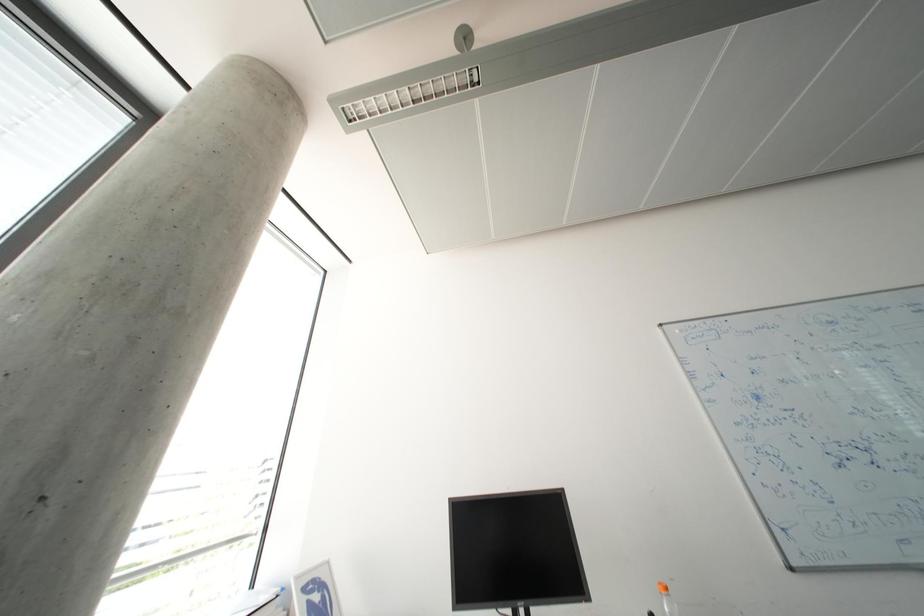
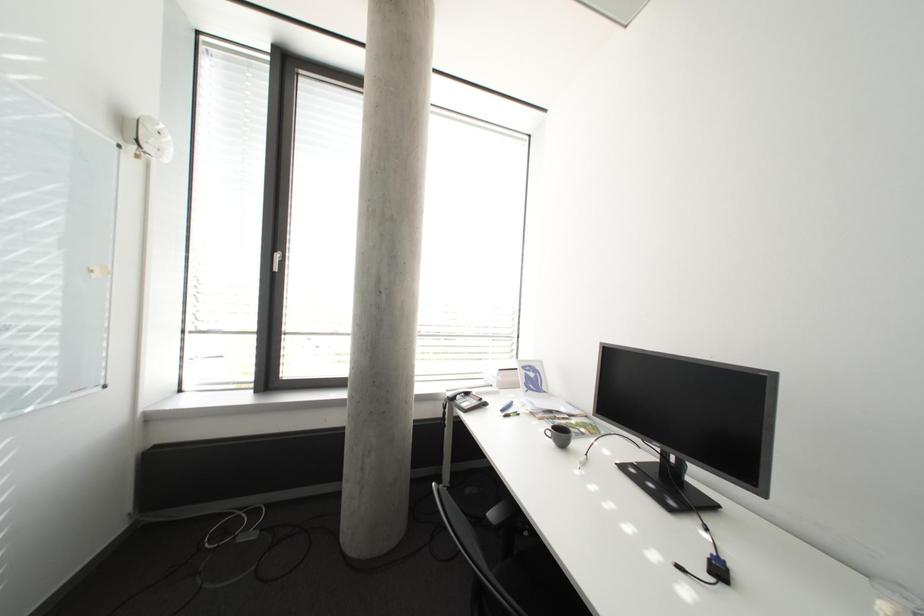
The images are taken continuously from a first-person perspective. In which direction is your viewpoint rotating?

The camera rotated toward left-down.